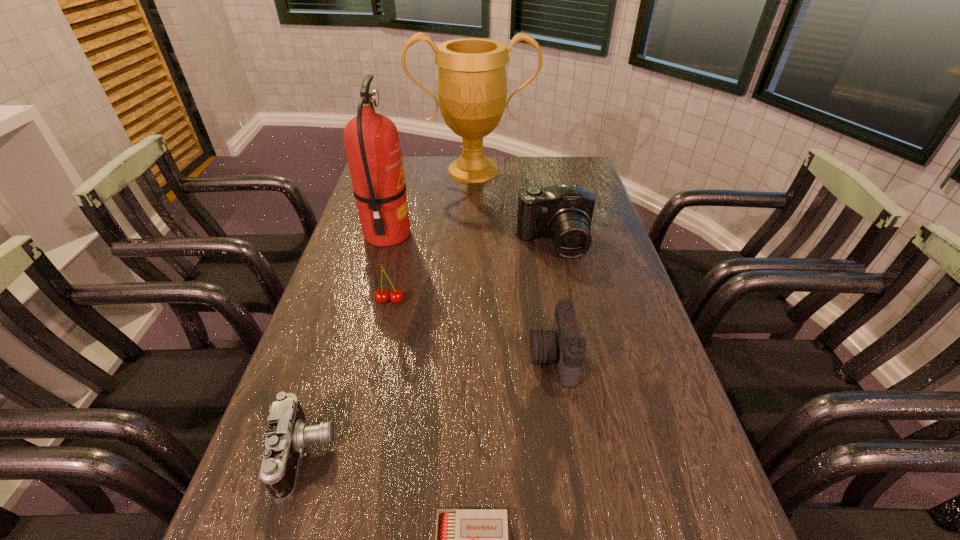
Where is `cherry that is at the left edge`? The image size is (960, 540). cherry that is at the left edge is located at coordinates (396, 296).

The width and height of the screenshot is (960, 540). I want to click on camera at the left edge, so click(x=287, y=434).

Image resolution: width=960 pixels, height=540 pixels. I want to click on object present at the right edge, so click(563, 212).

Locate an element on the screen. The image size is (960, 540). object at the far left corner is located at coordinates point(472,88).

In order to click on free space at the far edge in this screenshot , I will do `click(429, 165)`.

In the image, there is a desktop. Where is `free space at the left edge`? The width and height of the screenshot is (960, 540). free space at the left edge is located at coordinates (313, 345).

Identify the location of vacant space at the right edge. Image resolution: width=960 pixels, height=540 pixels. (632, 298).

The width and height of the screenshot is (960, 540). In order to click on free space between the cherry and the fire extinguisher in this screenshot , I will do `click(389, 268)`.

At what (x,y) coordinates should I click in order to perform the action: click on free space between the fire extinguisher and the farthest camera. Please return your answer as a coordinate pair (x, y). Looking at the image, I should click on (470, 239).

Find the location of a particular element. The height and width of the screenshot is (540, 960). free point between the fire extinguisher and the shortest camera is located at coordinates (347, 345).